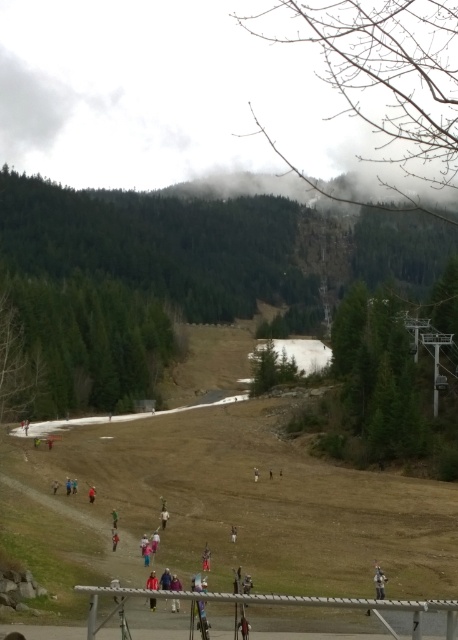
Which is more to the right, light blue jacket at center or light brown fabric jacket at lower center?

From the viewer's perspective, light blue jacket at center appears more on the right side.

Which is more to the left, light blue jacket at center or light brown fabric jacket at lower center?

light brown fabric jacket at lower center

What do you see at coordinates (152, 580) in the screenshot? I see `light blue jacket at center` at bounding box center [152, 580].

Identify the location of light blue jacket at center. (152, 580).

Describe the element at coordinates (114, 540) in the screenshot. I see `red fabric jacket at center` at that location.

Does red fabric jacket at center come in front of red fabric person at center?

That is True.

What do you see at coordinates (114, 540) in the screenshot? The image size is (458, 640). I see `red fabric jacket at center` at bounding box center [114, 540].

At what (x,y) coordinates should I click in order to perform the action: click on red fabric jacket at center. Please return your answer as a coordinate pair (x, y). The image size is (458, 640). Looking at the image, I should click on (114, 540).

Looking at this image, does light blue jacket at center appear on the left side of red jacket at center?

Correct, you'll find light blue jacket at center to the left of red jacket at center.

Between light blue jacket at center and red jacket at center, which one appears on the right side from the viewer's perspective?

red jacket at center is more to the right.

Describe the element at coordinates (152, 580) in the screenshot. This screenshot has width=458, height=640. I see `light blue jacket at center` at that location.

Where is `light blue jacket at center`? The image size is (458, 640). light blue jacket at center is located at coordinates (152, 580).